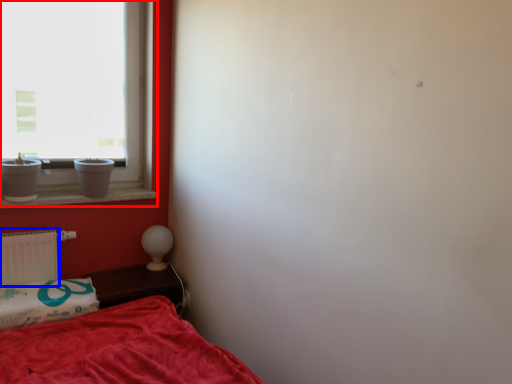
Question: Which object appears farthest to the camera in this image, window (highlighted by a red box) or radiator (highlighted by a blue box)?

Choices:
 (A) window
 (B) radiator

Answer: (B)